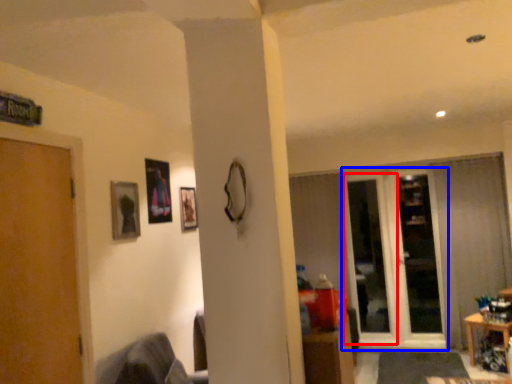
Question: Which of the following is the farthest to the observer, screen door (highlighted by a red box) or glass door (highlighted by a blue box)?

Choices:
 (A) screen door
 (B) glass door

Answer: (A)